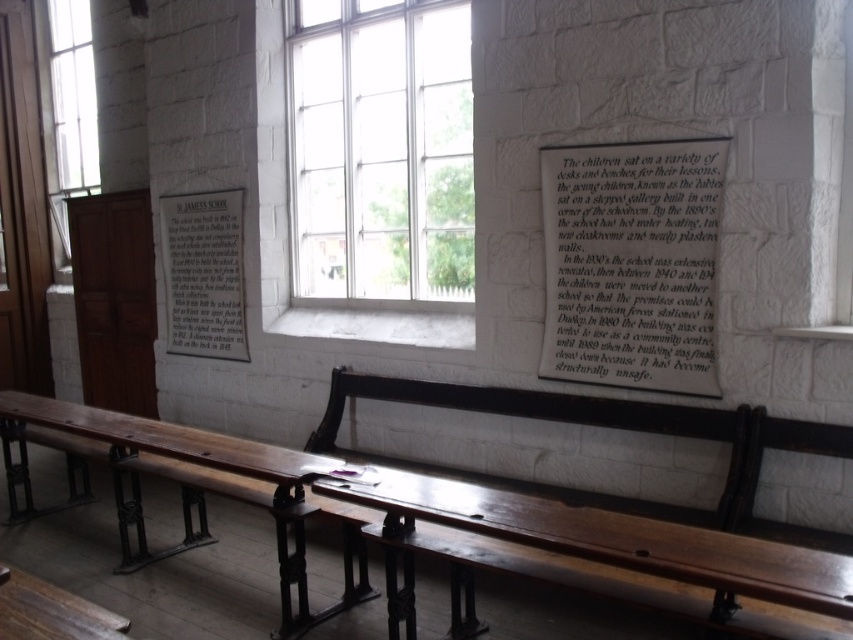
Question: Can you confirm if clear glass window at center is positioned below white paper at upper center?

Choices:
 (A) yes
 (B) no

Answer: (B)

Question: Which point is farther to the camera?

Choices:
 (A) clear glass window at upper left
 (B) white paper at upper center
 (C) clear glass window at center

Answer: (A)

Question: Is clear glass window at center to the right of clear glass window at upper left from the viewer's perspective?

Choices:
 (A) no
 (B) yes

Answer: (B)

Question: Is white paper at upper center wider than clear glass window at upper left?

Choices:
 (A) yes
 (B) no

Answer: (A)

Question: Which of these objects is positioned closest to the clear glass window at center?

Choices:
 (A) white paper at upper center
 (B) wooden polished bench at center
 (C) white paper plaque at center
 (D) clear glass window at upper left

Answer: (C)

Question: Which of the following is the closest to the observer?

Choices:
 (A) click(177, 328)
 (B) click(84, 413)

Answer: (B)